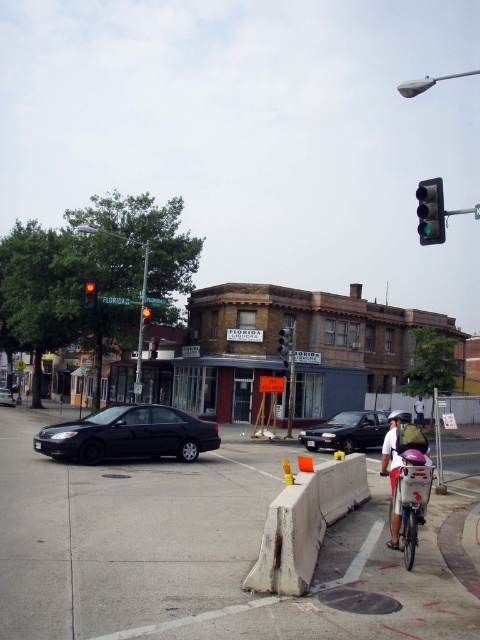
In the scene shown: You are a delivery person standing at the curb next to the cyclist. You need to cross the street to reach the Florida Liquors building. Is the matte black sedan at center blocking your path? Please explain your reasoning.

The matte black sedan at center is positioned at coordinates point (x=129, y=435). Since the cyclist is waiting at the curb and the sedan is at the center of the image, it is likely blocking the path to the Florida Liquors building. However, without knowing the exact layout of the street and the positioning of the sidewalk relative to the sedan, it is impossible to definitively confirm if the sedan is directly in the way. The answer requires more information about the street layout and the sedan position in 3

You are a pedestrian standing at the intersection and see the metallic silver bicycle at lower right and the light blue shirt at center. Which object is closer to the curb?

The metallic silver bicycle at lower right is closer to the curb because it is positioned to the left of the light blue shirt at center, which is further away from the curb.

You are a pedestrian trying to cross the street at the intersection shown. You see a matte black sedan at center and a shiny black sedan at center. Which one is positioned higher in the image?

The matte black sedan at center is located above the shiny black sedan at center in the image.